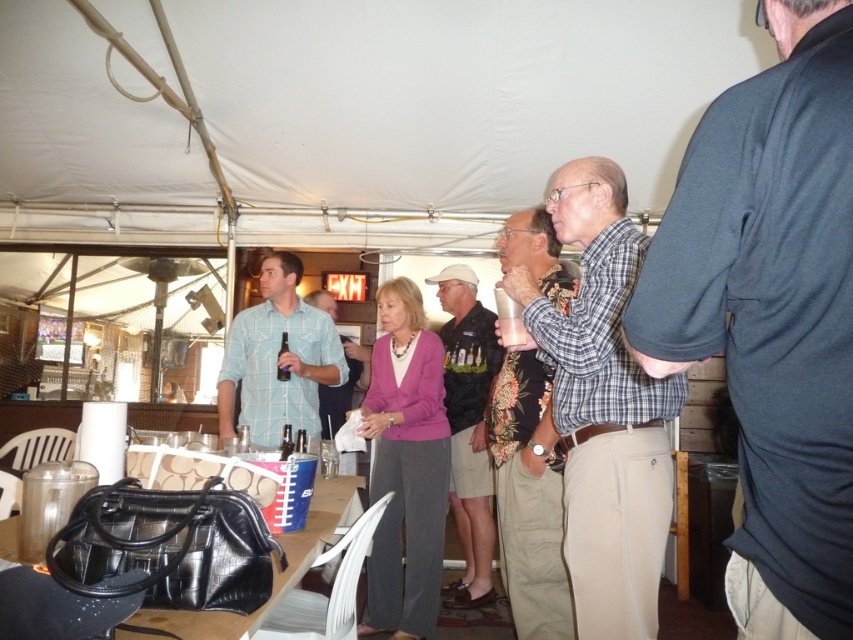
Question: Does dark blue fabric shirt at right come in front of light blue plaid shirt at center?

Choices:
 (A) no
 (B) yes

Answer: (B)

Question: Which of the following is the closest to the observer?

Choices:
 (A) light blue plaid shirt at center
 (B) plaid shirt at center

Answer: (B)

Question: Which of these objects is positioned farthest from the plaid shirt at center?

Choices:
 (A) dark blue fabric shirt at right
 (B) floral fabric shirt at center

Answer: (A)

Question: Can you confirm if dark blue fabric shirt at right is positioned to the right of dark gray cotton shirt at center?

Choices:
 (A) no
 (B) yes

Answer: (B)

Question: Which point is closer to the camera?

Choices:
 (A) (688, 316)
 (B) (529, 572)
 (C) (302, 353)
 (D) (619, 292)

Answer: (A)

Question: Does light blue plaid shirt at center have a greater width compared to dark gray cotton shirt at center?

Choices:
 (A) no
 (B) yes

Answer: (B)